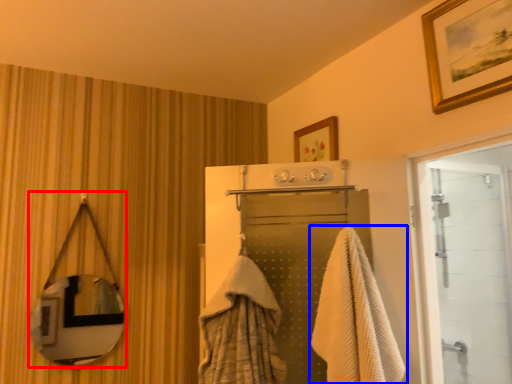
Question: Which point is closer to the camera, mirror (highlighted by a red box) or towel (highlighted by a blue box)?

Choices:
 (A) mirror
 (B) towel

Answer: (B)